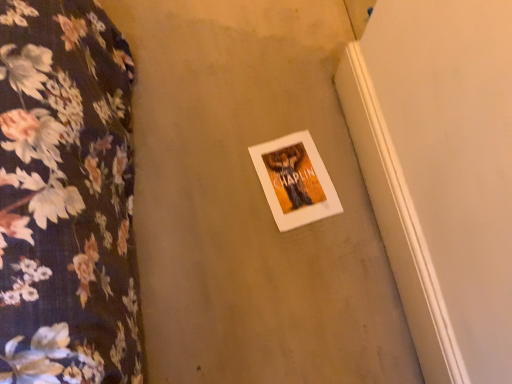
Locate an element on the screen. Image resolution: width=512 pixels, height=384 pixels. free location above white paper at center (from a real-world perspective) is located at coordinates (290, 173).